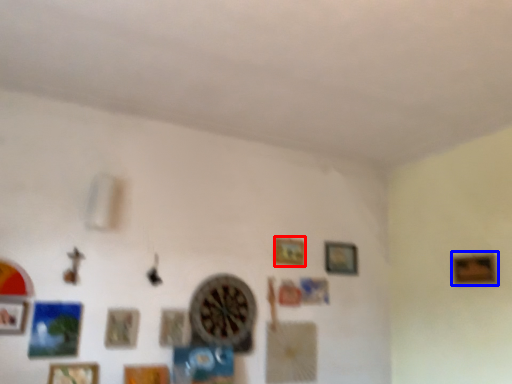
Question: Which of the following is the closest to the observer, picture frame (highlighted by a red box) or picture frame (highlighted by a blue box)?

Choices:
 (A) picture frame
 (B) picture frame

Answer: (B)